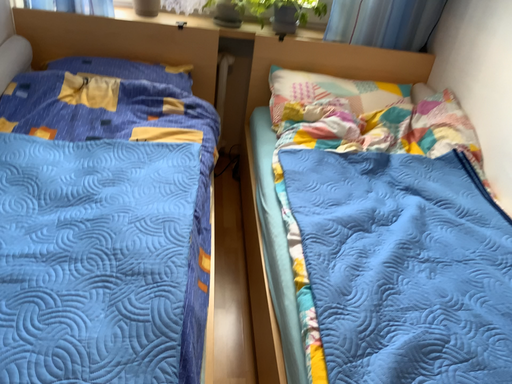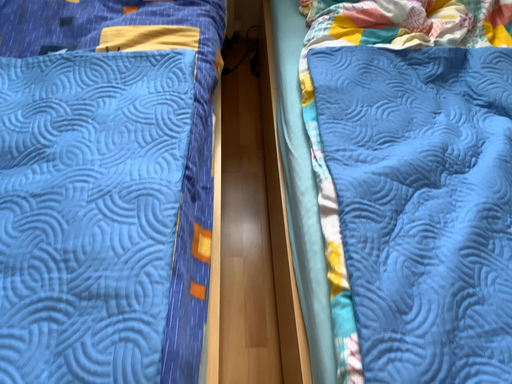
Question: Which way did the camera rotate in the video?

Choices:
 (A) rotated upward
 (B) rotated downward

Answer: (B)